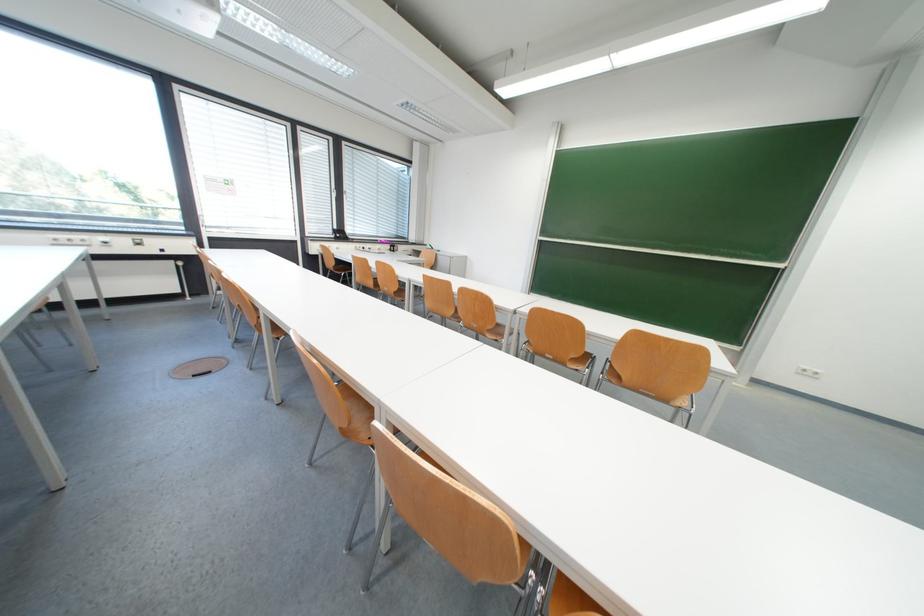
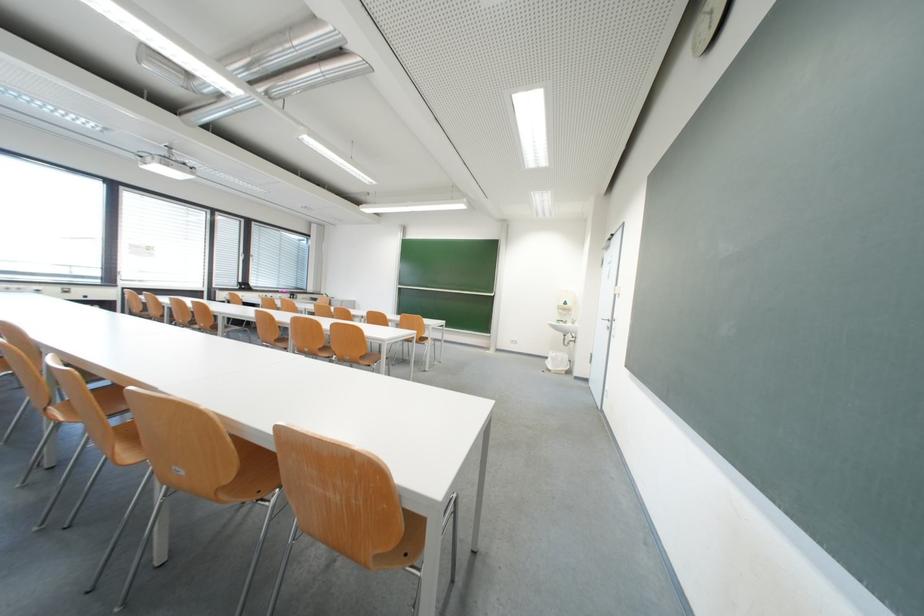
Question: In a continuous first-person perspective shot, in which direction is the camera moving?

Choices:
 (A) Left
 (B) Right
 (C) Forward
 (D) Backward

Answer: (D)